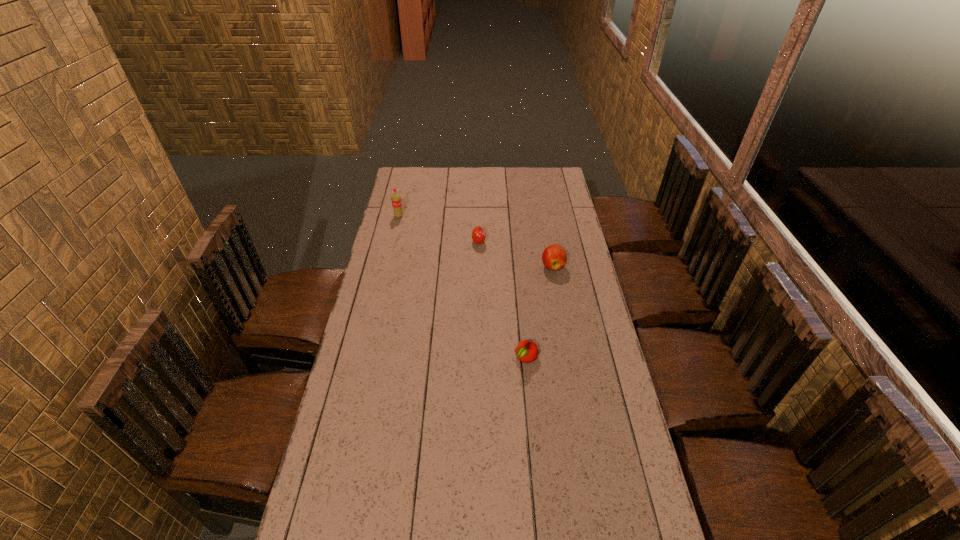
Where is `free space that satisfies the following two spatial constraints: 1. on the back side of the shortest apple; 2. on the right side of the second tallest object`? This screenshot has width=960, height=540. free space that satisfies the following two spatial constraints: 1. on the back side of the shortest apple; 2. on the right side of the second tallest object is located at coordinates (517, 266).

Identify the location of blank area in the image that satisfies the following two spatial constraints: 1. on the front side of the rightmost object; 2. on the right side of the leftmost object. (387, 266).